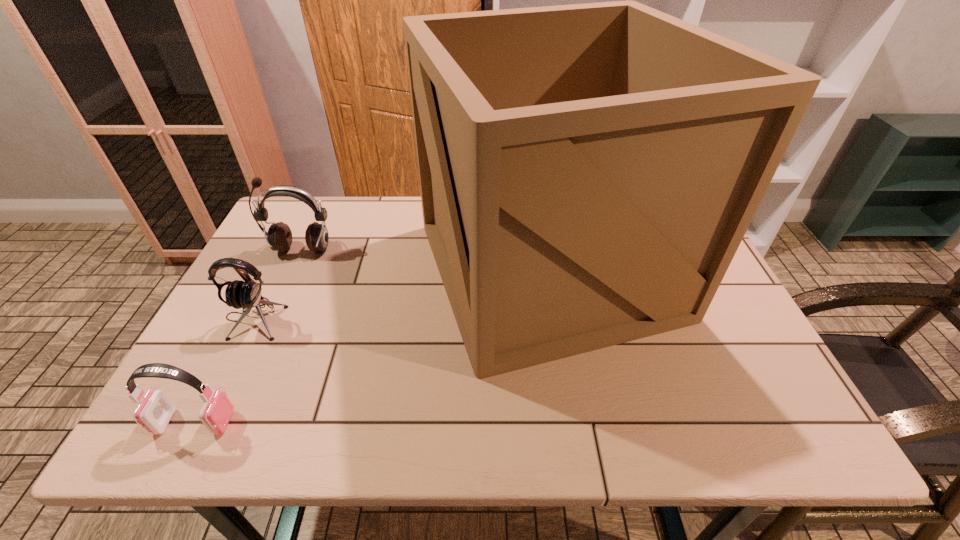
You are a GUI agent. You are given a task and a screenshot of the screen. Output one action in this format:
    pyautogui.click(x=<x>, y=<y>)
    Task: Click on the vacant space that is in between the nearest earphone and the second farthest earphone
    The image size is (960, 540).
    Given the screenshot: What is the action you would take?
    pyautogui.click(x=225, y=370)

The height and width of the screenshot is (540, 960). In order to click on object that is the closest to the nearest object in this screenshot , I will do `click(239, 294)`.

Identify the location of object that stands as the second closest to the second farthest earphone. pyautogui.click(x=155, y=412).

Locate an element on the screen. The image size is (960, 540). earphone that is the second closest to the nearest earphone is located at coordinates (279, 236).

Where is `earphone that is the second nearest to the nearest object`? earphone that is the second nearest to the nearest object is located at coordinates (279, 236).

Locate an element on the screen. vacant space that satisfies the following two spatial constraints: 1. on the front side of the rightmost object; 2. on the outer surface of the nearest object is located at coordinates pyautogui.click(x=573, y=422).

The width and height of the screenshot is (960, 540). In order to click on vacant space that satisfies the following two spatial constraints: 1. on the ear pads of the farthest earphone; 2. on the outer surface of the nearest object in this screenshot , I will do `click(220, 422)`.

Where is `vacant area that satisfies the following two spatial constraints: 1. on the ear pads of the rightmost object; 2. on the left side of the farthest earphone`? The height and width of the screenshot is (540, 960). vacant area that satisfies the following two spatial constraints: 1. on the ear pads of the rightmost object; 2. on the left side of the farthest earphone is located at coordinates (292, 269).

Locate an element on the screen. This screenshot has width=960, height=540. blank area in the image that satisfies the following two spatial constraints: 1. on the ear pads of the tallest object; 2. on the right side of the farthest earphone is located at coordinates (292, 269).

Locate an element on the screen. The height and width of the screenshot is (540, 960). vacant area that satisfies the following two spatial constraints: 1. on the ear pads of the tallest object; 2. on the left side of the farthest earphone is located at coordinates (292, 269).